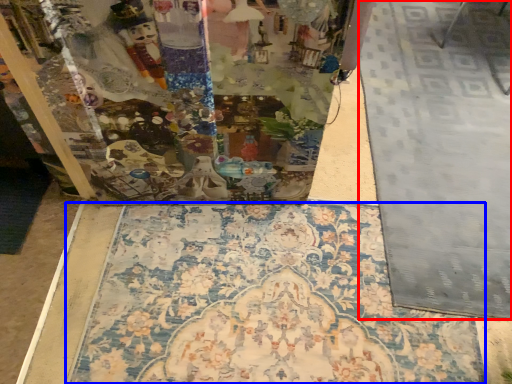
Question: Which object appears farthest to the camera in this image, tile (highlighted by a red box) or mat (highlighted by a blue box)?

Choices:
 (A) tile
 (B) mat

Answer: (A)